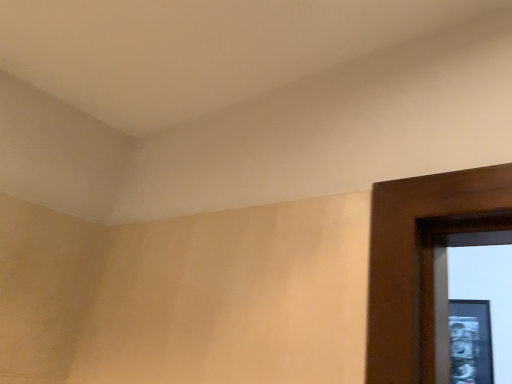
This screenshot has width=512, height=384. What do you see at coordinates (470, 342) in the screenshot?
I see `black glass picture frame at right` at bounding box center [470, 342].

What is the approximate height of black glass picture frame at right?

It is 14.19 inches.

Where is `black glass picture frame at right`? black glass picture frame at right is located at coordinates (470, 342).

The width and height of the screenshot is (512, 384). Find the location of `black glass picture frame at right`. black glass picture frame at right is located at coordinates (470, 342).